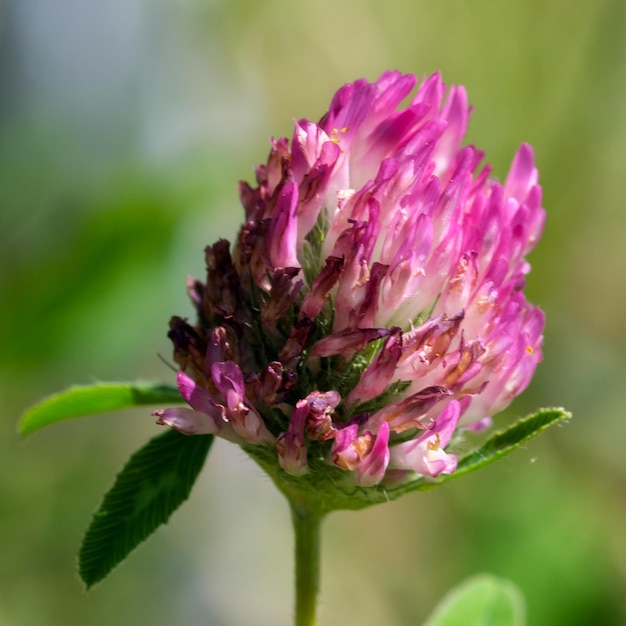
I want to click on pink pedestals, so click(x=385, y=265).